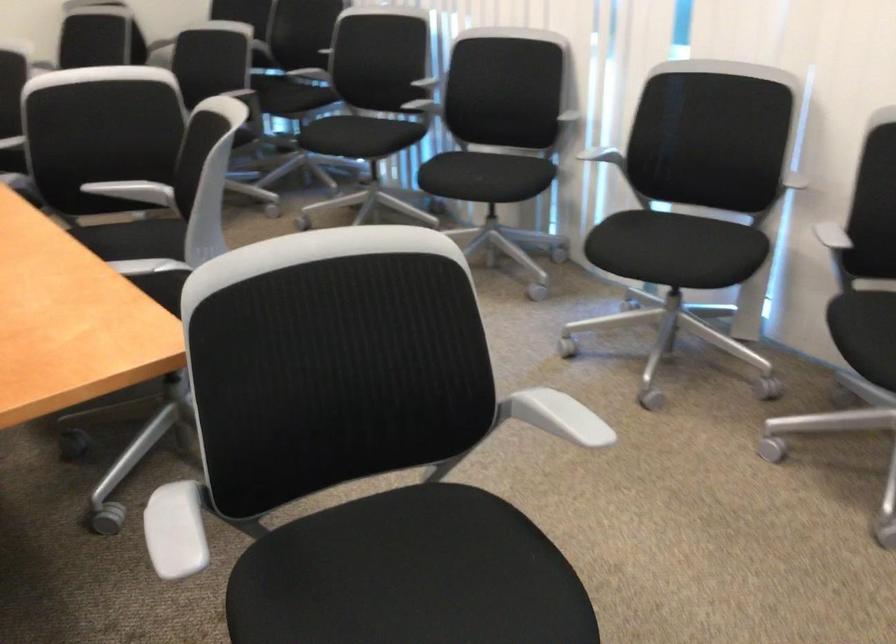
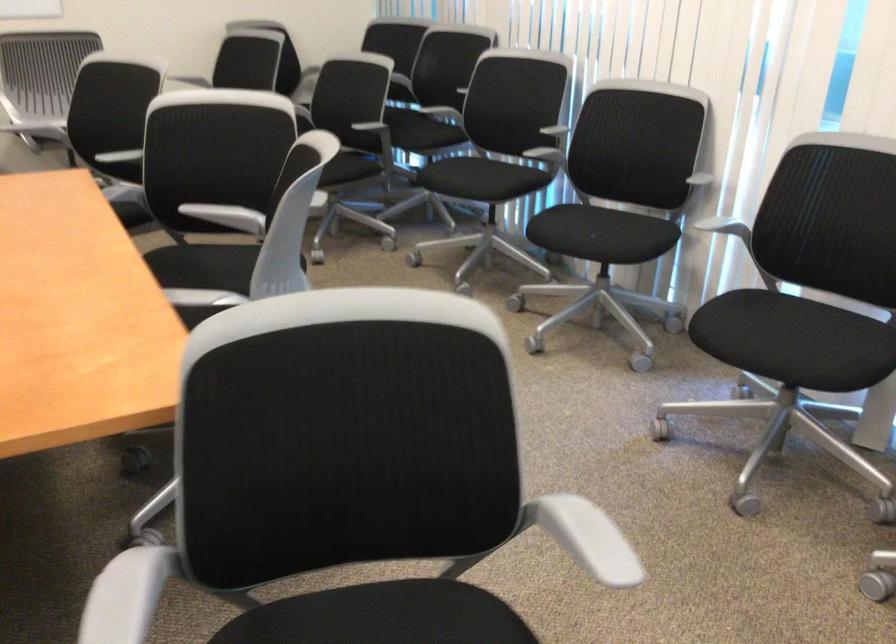
In the second image, find the point that corresponds to [679,247] in the first image.

(795, 342)